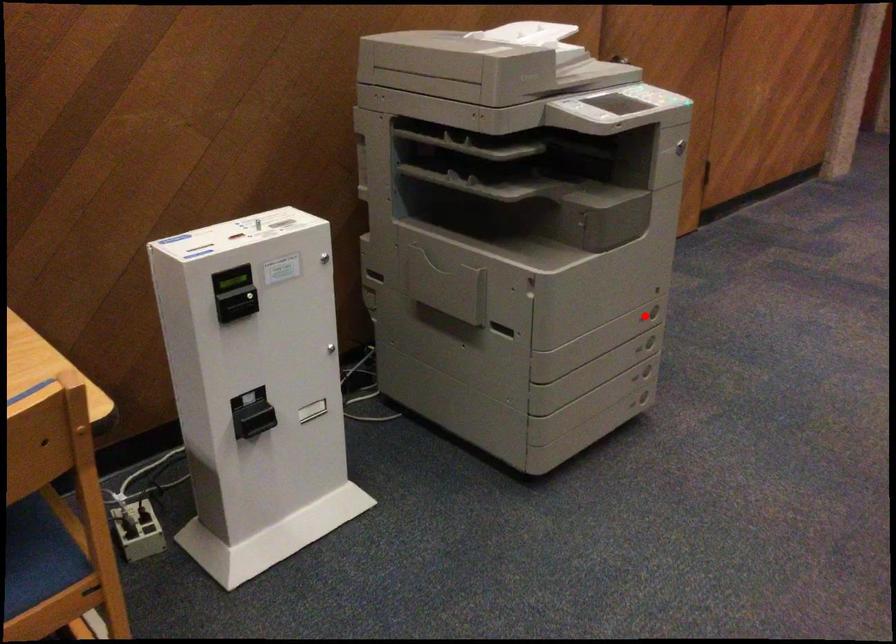
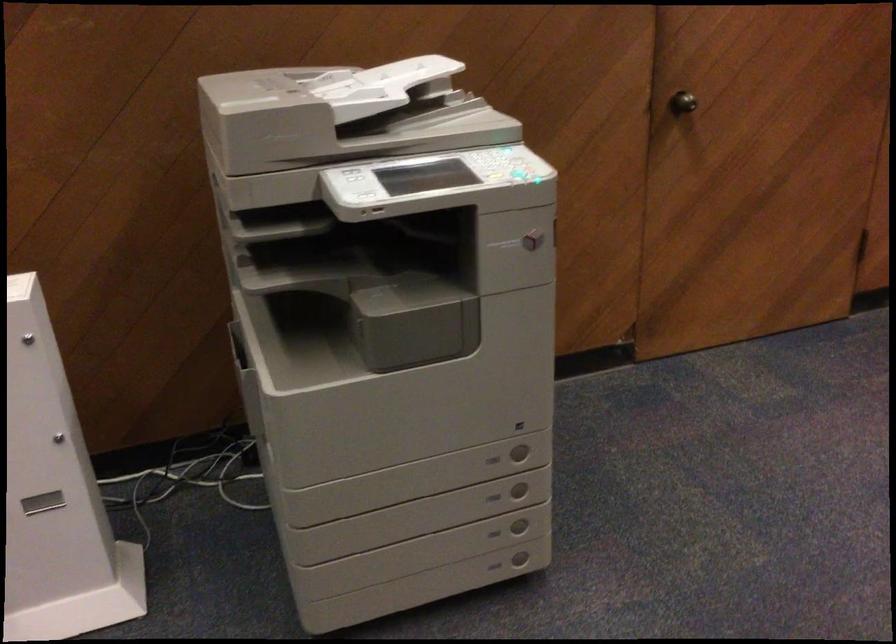
Where in the second image is the point corresponding to the highlighted location from the first image?

(492, 459)